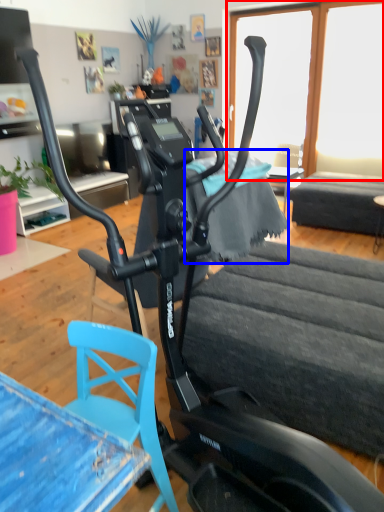
Question: Which object is closer to the camera taking this photo, window screen (highlighted by a red box) or fabric (highlighted by a blue box)?

Choices:
 (A) window screen
 (B) fabric

Answer: (B)